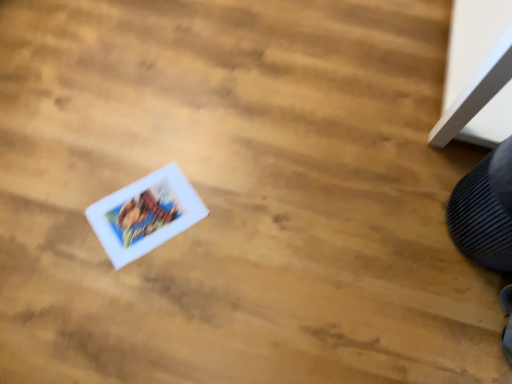
Where is `vacant area that lies between black textured shoe at lower right and white matte comic book at center`? Image resolution: width=512 pixels, height=384 pixels. vacant area that lies between black textured shoe at lower right and white matte comic book at center is located at coordinates (316, 220).